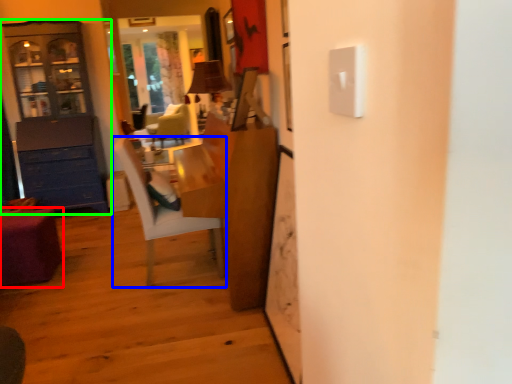
Question: Based on their relative distances, which object is nearer to desk (highlighted by a red box)? Choose from chair (highlighted by a blue box) and cabinetry (highlighted by a green box).

Choices:
 (A) chair
 (B) cabinetry

Answer: (A)